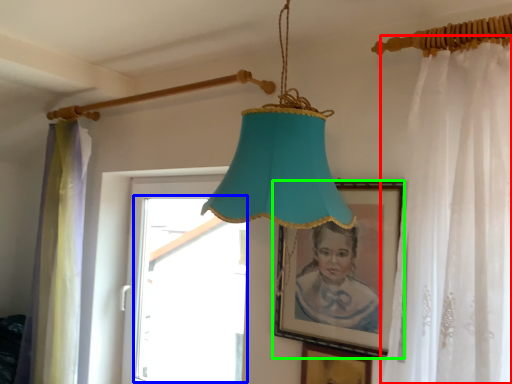
Question: Which object is the closest to the curtain (highlighted by a red box)? Choose among these: window (highlighted by a blue box) or picture frame (highlighted by a green box).

Choices:
 (A) window
 (B) picture frame

Answer: (B)